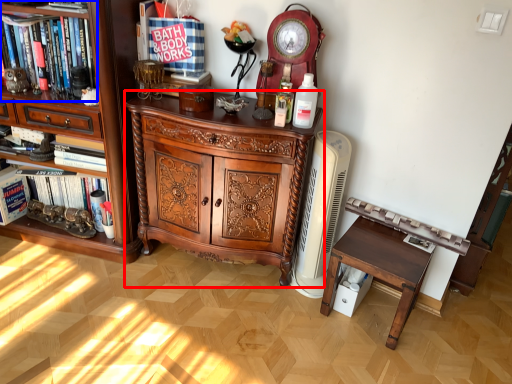
Question: Which object is further to the camera taking this photo, chest of drawers (highlighted by a red box) or shelf (highlighted by a blue box)?

Choices:
 (A) chest of drawers
 (B) shelf

Answer: (B)